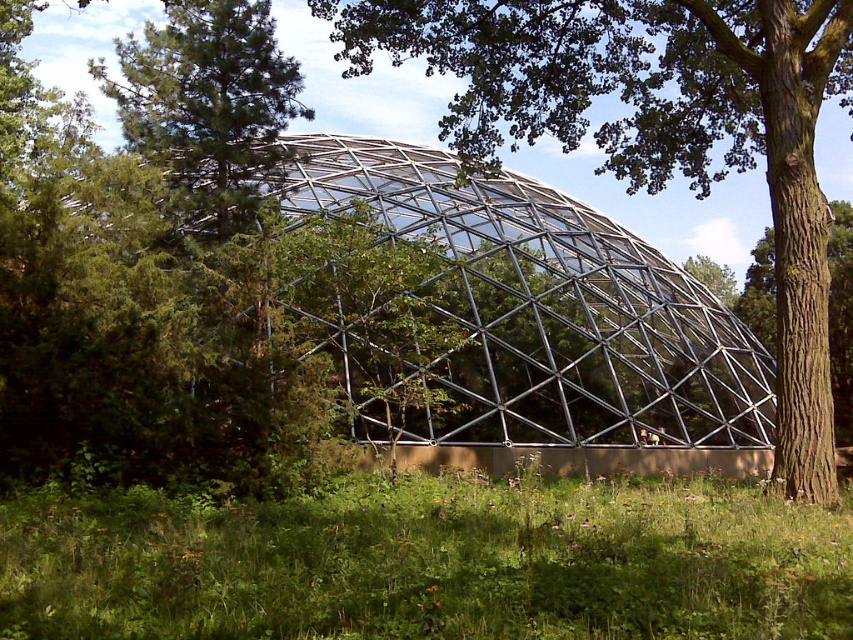
What do you see at coordinates (207, 108) in the screenshot? I see `green leafy tree at upper left` at bounding box center [207, 108].

Who is higher up, green leafy tree at upper left or brown rough bark tree at right?

green leafy tree at upper left is higher up.

Is point (271, 125) in front of point (836, 385)?

Yes, point (271, 125) is closer to viewer.

Locate an element on the screen. This screenshot has width=853, height=640. green leafy tree at upper left is located at coordinates (207, 108).

Does green grass at center have a greater height compared to green leafy tree at upper left?

No, green grass at center is not taller than green leafy tree at upper left.

Does point (325, 492) come in front of point (166, 4)?

Yes.

You are a GUI agent. You are given a task and a screenshot of the screen. Output one action in this format:
    pyautogui.click(x=<x>, y=<y>)
    Task: Click on the green grass at center
    The image size is (853, 640).
    Given the screenshot: What is the action you would take?
    pyautogui.click(x=430, y=561)

Does green grass at center appear over brown rough tree at center?

No, green grass at center is not above brown rough tree at center.

Can you confirm if green grass at center is positioned to the left of brown rough tree at center?

Indeed, green grass at center is positioned on the left side of brown rough tree at center.

Is point (323, 532) less distant than point (450, 112)?

Yes, point (323, 532) is closer to viewer.

I want to click on green grass at center, so click(430, 561).